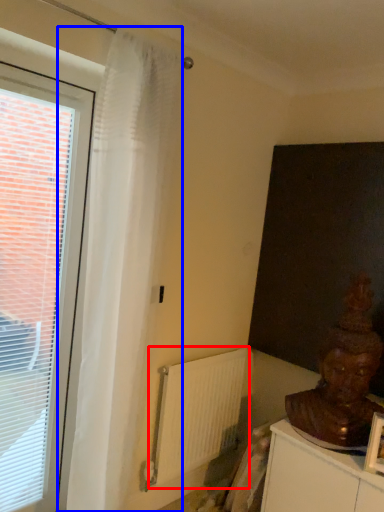
Question: Which object is further to the camera taking this photo, radiator (highlighted by a red box) or curtain (highlighted by a blue box)?

Choices:
 (A) radiator
 (B) curtain

Answer: (A)